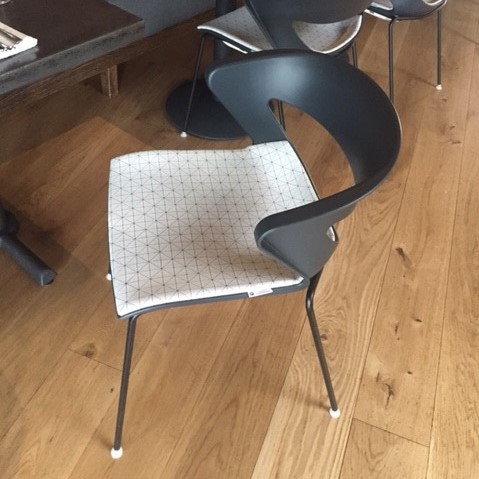
Image resolution: width=479 pixels, height=479 pixels. I want to click on plastic floor protectors on chair legs, so click(x=117, y=453), click(x=338, y=414), click(x=108, y=276), click(x=182, y=133), click(x=439, y=87).